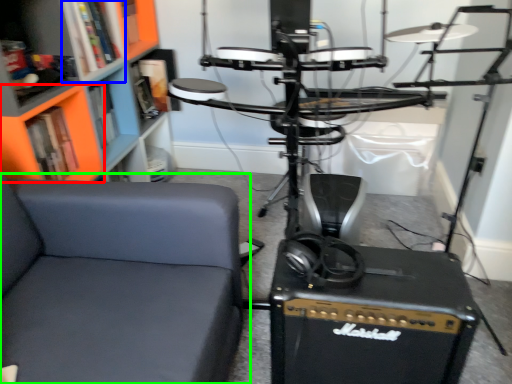
Question: Based on their relative distances, which object is farther from shelf (highlighted by a red box)? Choose from shelf (highlighted by a blue box) and chair (highlighted by a green box).

Choices:
 (A) shelf
 (B) chair

Answer: (B)